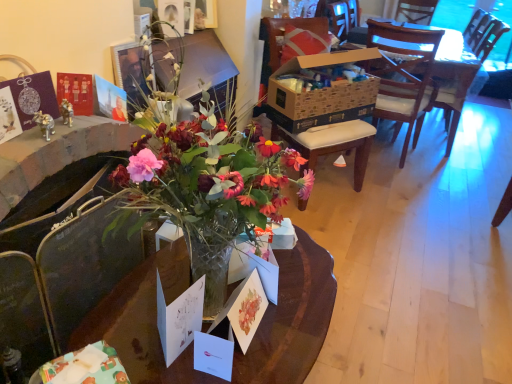
Locate an element on the screen. Image resolution: width=512 pixels, height=384 pixels. vacant area that is situated to the right of white paper postcard at center, which appears as the second postcard when viewed from the left is located at coordinates (270, 357).